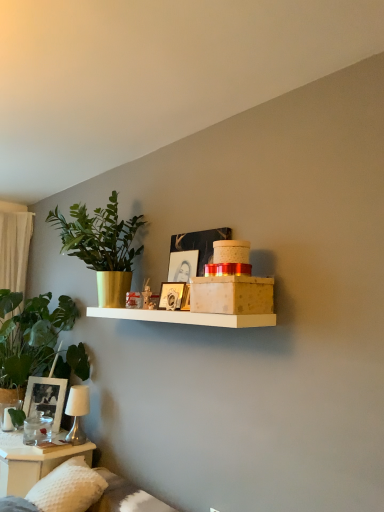
Question: Is metallic silver table lamp at lower left at the right side of clear glass water at lower left?

Choices:
 (A) no
 (B) yes

Answer: (B)

Question: Can we say metallic silver table lamp at lower left lies outside clear glass water at lower left?

Choices:
 (A) no
 (B) yes

Answer: (B)

Question: Can you confirm if metallic silver table lamp at lower left is thinner than clear glass water at lower left?

Choices:
 (A) yes
 (B) no

Answer: (A)

Question: Is metallic silver table lamp at lower left to the left of clear glass water at lower left from the viewer's perspective?

Choices:
 (A) yes
 (B) no

Answer: (B)

Question: Is metallic silver table lamp at lower left positioned in front of clear glass water at lower left?

Choices:
 (A) yes
 (B) no

Answer: (B)

Question: Is matte glass photo frame at lower left, arranged as the second picture frame when viewed from the front, taller or shorter than matte gold picture frame at center, placed as the 2th picture frame when sorted from bottom to top?

Choices:
 (A) short
 (B) tall

Answer: (B)

Question: Is matte glass photo frame at lower left, the first picture frame when ordered from bottom to top, in front of or behind matte gold picture frame at center, the 1th picture frame when ordered from right to left, in the image?

Choices:
 (A) front
 (B) behind

Answer: (B)

Question: Considering the relative positions of matte glass photo frame at lower left, which is counted as the first picture frame, starting from the back, and matte gold picture frame at center, the 1th picture frame when ordered from right to left, in the image provided, is matte glass photo frame at lower left, which is counted as the first picture frame, starting from the back, to the left or to the right of matte gold picture frame at center, the 1th picture frame when ordered from right to left,?

Choices:
 (A) left
 (B) right

Answer: (A)

Question: Is matte glass photo frame at lower left, arranged as the second picture frame when viewed from the front, wider or thinner than matte gold picture frame at center, positioned as the second picture frame in left-to-right order?

Choices:
 (A) thin
 (B) wide

Answer: (B)

Question: In terms of width, does clear glass water at lower left look wider or thinner when compared to metallic silver table lamp at lower left?

Choices:
 (A) thin
 (B) wide

Answer: (B)

Question: Is clear glass water at lower left inside or outside of metallic silver table lamp at lower left?

Choices:
 (A) outside
 (B) inside

Answer: (A)

Question: From a real-world perspective, is clear glass water at lower left physically located above or below metallic silver table lamp at lower left?

Choices:
 (A) above
 (B) below

Answer: (B)

Question: Looking at the image, does clear glass water at lower left seem bigger or smaller compared to metallic silver table lamp at lower left?

Choices:
 (A) big
 (B) small

Answer: (A)

Question: Considering the positions of matte glass photo frame at lower left, the first picture frame when ordered from bottom to top, and clear glass water at lower left in the image, is matte glass photo frame at lower left, the first picture frame when ordered from bottom to top, wider or thinner than clear glass water at lower left?

Choices:
 (A) thin
 (B) wide

Answer: (A)

Question: Do you think matte glass photo frame at lower left, the 1th picture frame in the left-to-right sequence, is within clear glass water at lower left, or outside of it?

Choices:
 (A) inside
 (B) outside

Answer: (B)